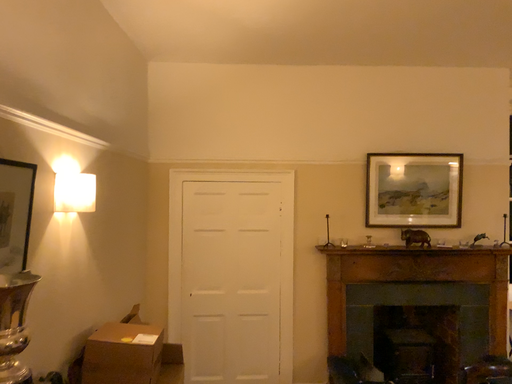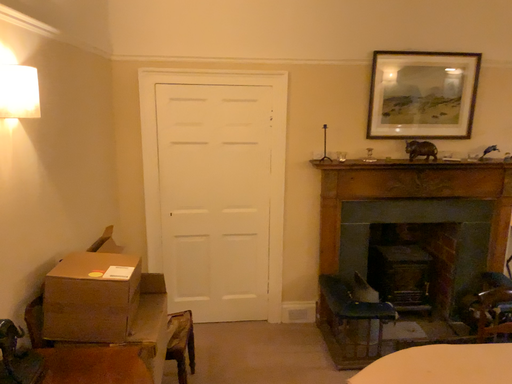
Question: How did the camera likely rotate when shooting the video?

Choices:
 (A) rotated upward
 (B) rotated downward

Answer: (B)